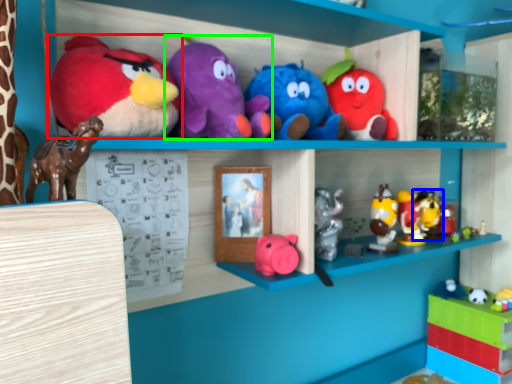
Question: Which object is the farthest from toy (highlighted by a red box)? Choose among these: toy (highlighted by a blue box) or toy (highlighted by a green box).

Choices:
 (A) toy
 (B) toy

Answer: (A)